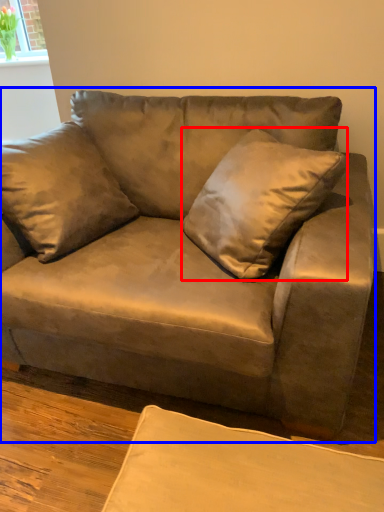
Question: Among these objects, which one is nearest to the camera, throw pillow (highlighted by a red box) or studio couch (highlighted by a blue box)?

Choices:
 (A) throw pillow
 (B) studio couch

Answer: (B)